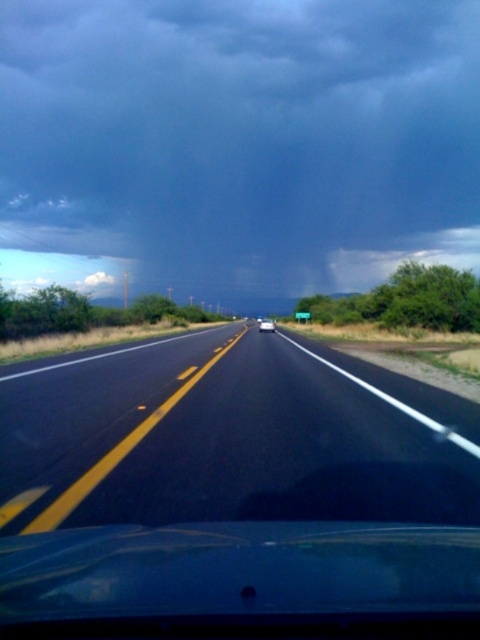
Does dark gray cloud at upper center lie in front of white glossy sedan at center?

No, dark gray cloud at upper center is further to the viewer.

Does point (344, 4) come closer to viewer compared to point (262, 320)?

No, (344, 4) is further to viewer.

Find the location of a particular element. Image resolution: width=480 pixels, height=640 pixels. dark gray cloud at upper center is located at coordinates (237, 145).

Is dark gray cloud at upper center wider than black asphalt highway at center?

Yes, dark gray cloud at upper center is wider than black asphalt highway at center.

This screenshot has height=640, width=480. What do you see at coordinates (237, 145) in the screenshot? I see `dark gray cloud at upper center` at bounding box center [237, 145].

Between point (342, 116) and point (414, 385), which one is positioned behind?

The point (342, 116) is behind.

Find the location of a particular element. dark gray cloud at upper center is located at coordinates (237, 145).

Does black asphalt highway at center come behind white glossy sedan at center?

That is False.

Who is more distant from viewer, [218,394] or [261,323]?

Positioned behind is point [261,323].

Is point (312, 371) positioned after point (267, 320)?

No, (312, 371) is closer to viewer.

The image size is (480, 640). Find the location of `black asphalt highway at center`. black asphalt highway at center is located at coordinates (228, 436).